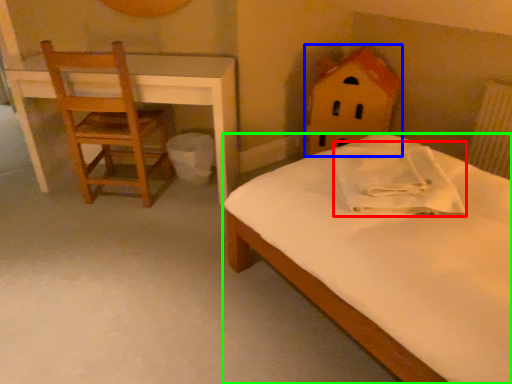
Question: Which object is the closest to the pillow (highlighted by a red box)? Choose among these: toy (highlighted by a blue box) or bed (highlighted by a green box).

Choices:
 (A) toy
 (B) bed

Answer: (B)